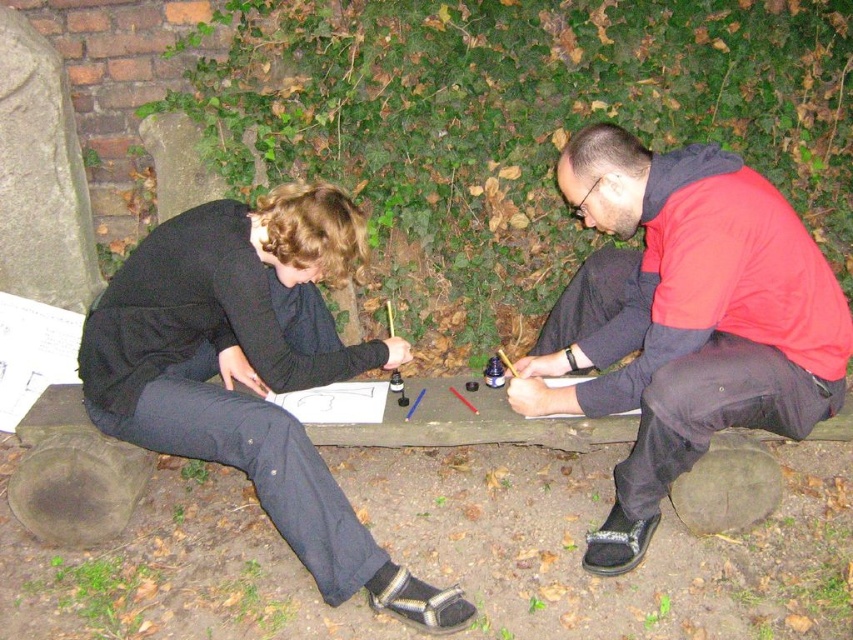
You are trying to decide which jacket to borrow based on size. You need a larger jacket for warmth. Which one should you choose between the black fabric jacket at center and the red fabric jacket at right?

The black fabric jacket at center is larger in size compared to the red fabric jacket at right, so you should choose the black fabric jacket at center for warmth.

You are standing in front of the two people drawing outside. There is a point at coordinates (683,320). Which object from the following list is this point located on? The options are the black fabric jacket at center, the brick wall with ivy in the background, or the wooden bench they are sitting on.

The point at coordinates (683,320) is located on the black fabric jacket at center.